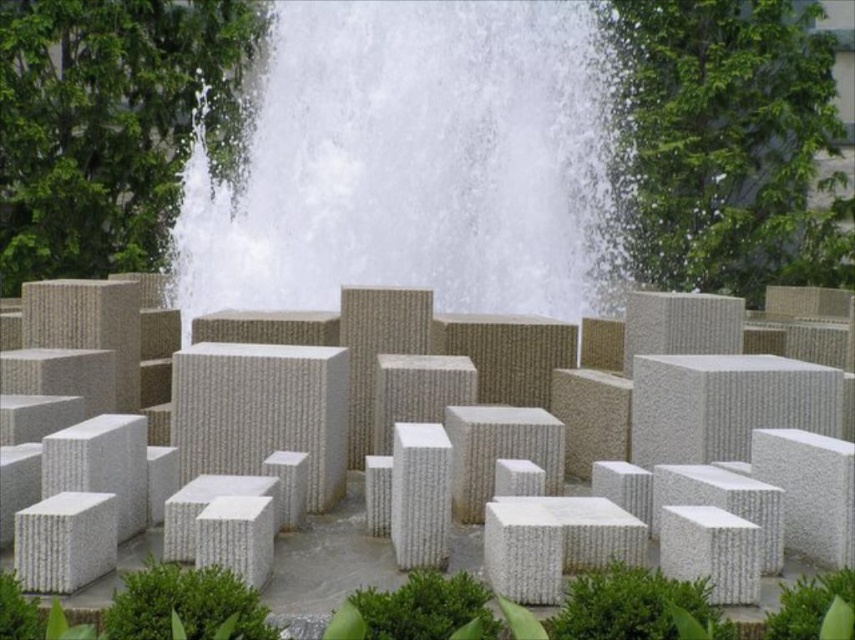
Question: Among these objects, which one is nearest to the camera?

Choices:
 (A) white textured water at center
 (B) white textured blocks at center

Answer: (B)

Question: Where is white textured water at center located in relation to white textured blocks at center in the image?

Choices:
 (A) left
 (B) right

Answer: (B)

Question: Where is white textured water at center located in relation to white textured blocks at center in the image?

Choices:
 (A) right
 (B) left

Answer: (A)

Question: Which point is farther from the camera taking this photo?

Choices:
 (A) [315, 305]
 (B) [183, 561]

Answer: (A)

Question: Can you confirm if white textured water at center is bigger than white textured blocks at center?

Choices:
 (A) yes
 (B) no

Answer: (A)